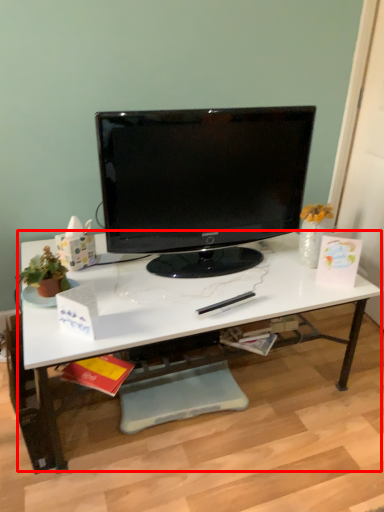
Question: From the image's perspective, what is the correct spatial positioning of desk (annotated by the red box) in reference to computer monitor?

Choices:
 (A) above
 (B) below

Answer: (B)